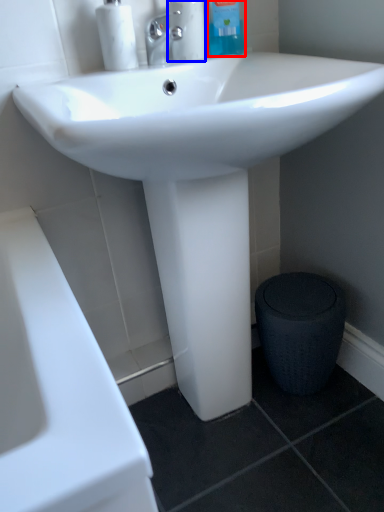
Question: Which object is further to the camera taking this photo, cleaning product (highlighted by a red box) or cleaning product (highlighted by a blue box)?

Choices:
 (A) cleaning product
 (B) cleaning product

Answer: (A)